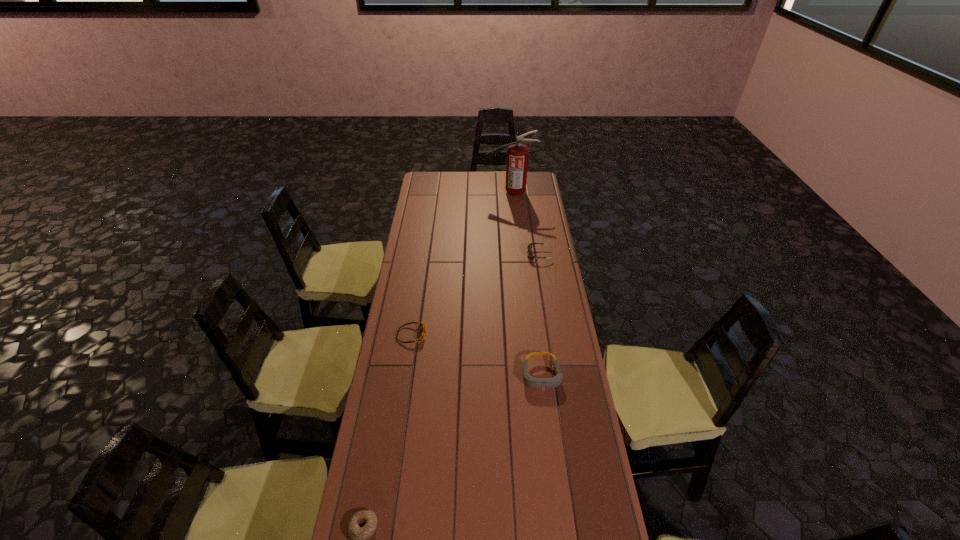
In order to click on the tallest object in this screenshot , I will do `click(517, 154)`.

Locate an element on the screen. the farthest object is located at coordinates (517, 154).

Where is `the second tallest object`? This screenshot has width=960, height=540. the second tallest object is located at coordinates (530, 381).

Identify the location of the fourth farthest object. This screenshot has width=960, height=540. (530, 381).

Where is `the second farthest object`? Image resolution: width=960 pixels, height=540 pixels. the second farthest object is located at coordinates (529, 247).

This screenshot has width=960, height=540. What are the coordinates of `the second farthest goggles` in the screenshot? It's located at (423, 327).

Find the location of `the third farthest object`. the third farthest object is located at coordinates (423, 327).

The height and width of the screenshot is (540, 960). I want to click on vacant area situated at the nozzle of the farthest object, so click(465, 192).

I want to click on vacant space located 0.260m at the nozzle of the farthest object, so click(x=441, y=192).

Where is `vacant region located at the nozzle of the farthest object`? The width and height of the screenshot is (960, 540). vacant region located at the nozzle of the farthest object is located at coordinates (474, 192).